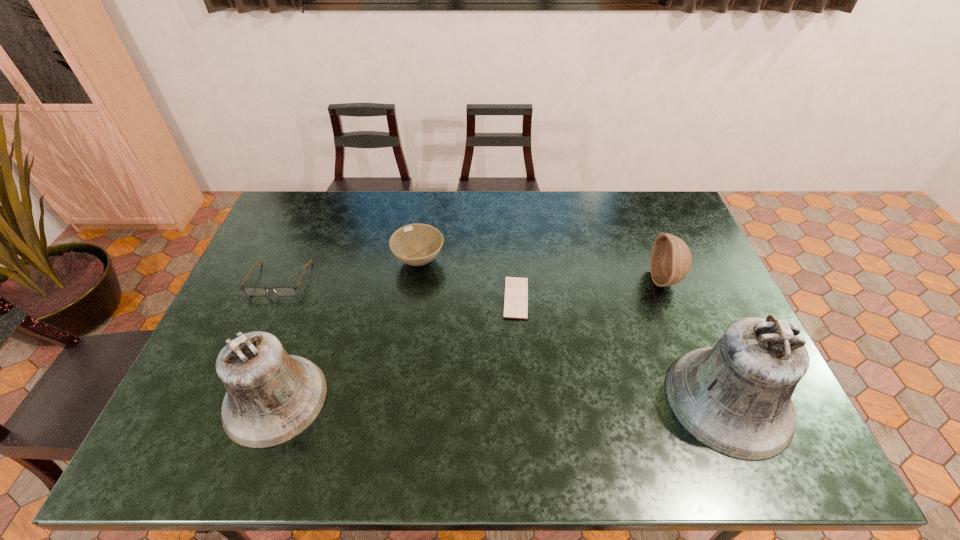
You are a GUI agent. You are given a task and a screenshot of the screen. Output one action in this format:
    pyautogui.click(x=<x>, y=<y>)
    Task: Click on the bowl present at the right edge
    
    Given the screenshot: What is the action you would take?
    pyautogui.click(x=671, y=259)

Find the location of `object that is at the near left corner`. object that is at the near left corner is located at coordinates (272, 397).

The height and width of the screenshot is (540, 960). What are the coordinates of `object located at the near right corner` in the screenshot? It's located at (735, 398).

The image size is (960, 540). In the image, there is a desktop. What are the coordinates of `vacant space at the far edge` in the screenshot? It's located at (628, 213).

This screenshot has height=540, width=960. In order to click on free space at the right edge of the desktop in this screenshot , I will do `click(702, 261)`.

At what (x,y) coordinates should I click in order to perform the action: click on vacant region at the far left corner of the desktop. Please return your answer as a coordinate pair (x, y). Looking at the image, I should click on (313, 205).

The image size is (960, 540). What are the coordinates of `free space between the spectacles and the shortest object` in the screenshot? It's located at (397, 288).

I want to click on unoccupied position between the second tallest object and the fourth object from left to right, so click(x=396, y=348).

Locate an element on the screen. The image size is (960, 540). free spot between the second shortest object and the shortest object is located at coordinates (397, 288).

Locate an element on the screen. free area in between the spectacles and the fourth shortest object is located at coordinates (472, 279).